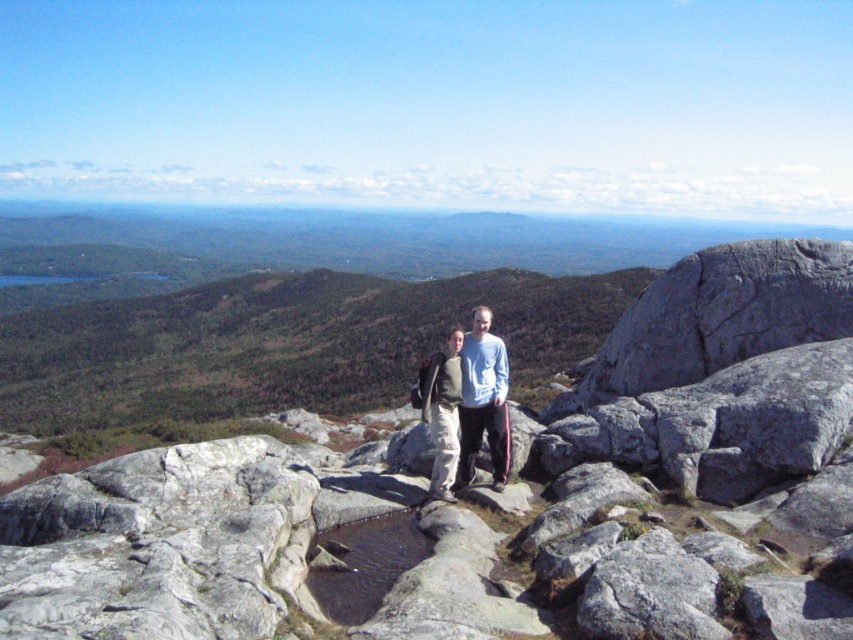
Between matte gray pants at center and light blue cotton shirt at center, which one is positioned lower?

Positioned lower is matte gray pants at center.

Between matte gray pants at center and light blue cotton shirt at center, which one appears on the left side from the viewer's perspective?

Positioned to the left is matte gray pants at center.

Find the location of a particular element. matte gray pants at center is located at coordinates (468, 404).

I want to click on matte gray pants at center, so click(x=468, y=404).

Between point (462, 339) and point (433, 372), which one is positioned in front?

Positioned in front is point (433, 372).

Is matte gray pants at center to the right of gray fabric jacket at center from the viewer's perspective?

No, matte gray pants at center is not to the right of gray fabric jacket at center.

Does point (492, 384) come behind point (444, 467)?

Yes.

Find the location of a particular element. The image size is (853, 640). matte gray pants at center is located at coordinates (468, 404).

Is point (495, 381) closer to camera compared to point (450, 362)?

That is False.

Does light blue cotton shirt at center appear on the left side of gray fabric jacket at center?

No, light blue cotton shirt at center is not to the left of gray fabric jacket at center.

Describe the element at coordinates (483, 401) in the screenshot. I see `light blue cotton shirt at center` at that location.

Find the location of a particular element. The image size is (853, 640). light blue cotton shirt at center is located at coordinates (483, 401).